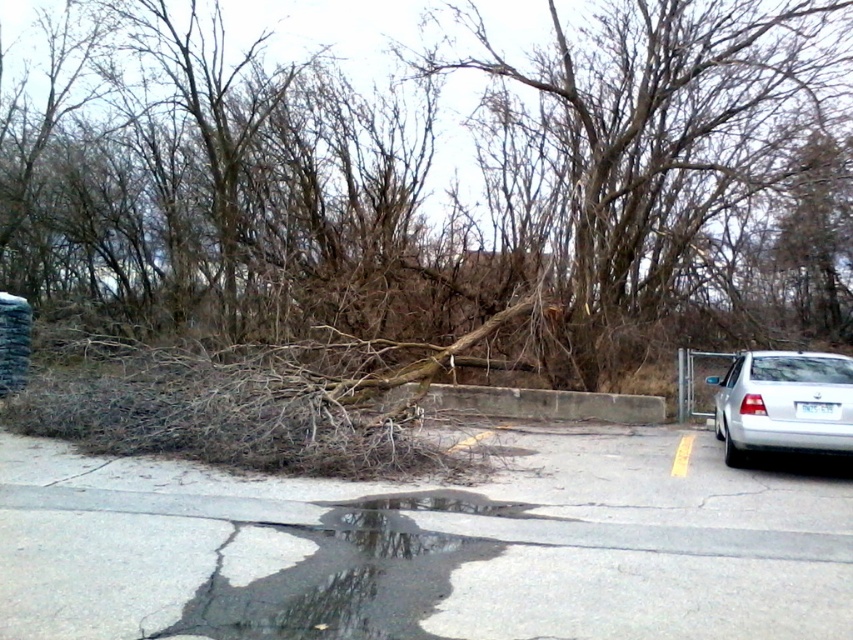
Can you confirm if transparent wet asphalt at lower center is positioned below silver metallic sedan at right?

Indeed, transparent wet asphalt at lower center is positioned under silver metallic sedan at right.

Does transparent wet asphalt at lower center have a greater width compared to silver metallic sedan at right?

Correct, the width of transparent wet asphalt at lower center exceeds that of silver metallic sedan at right.

Does point (379, 605) lie in front of point (846, 404)?

Yes, it is in front of point (846, 404).

Where is `transparent wet asphalt at lower center`? Image resolution: width=853 pixels, height=640 pixels. transparent wet asphalt at lower center is located at coordinates (340, 572).

Can you confirm if brown dry branches at center is thinner than transparent wet asphalt at lower center?

No.

Is point (457, 19) positioned after point (332, 548)?

That is True.

Where is `brown dry branches at center`? This screenshot has height=640, width=853. brown dry branches at center is located at coordinates (447, 186).

Can you confirm if brown dry branches at center is positioned to the right of silver metallic sedan at right?

Incorrect, brown dry branches at center is not on the right side of silver metallic sedan at right.

Who is higher up, brown dry branches at center or silver metallic sedan at right?

brown dry branches at center

Is point (115, 0) closer to camera compared to point (763, 376)?

That is False.

Where is `brown dry branches at center`? brown dry branches at center is located at coordinates (447, 186).